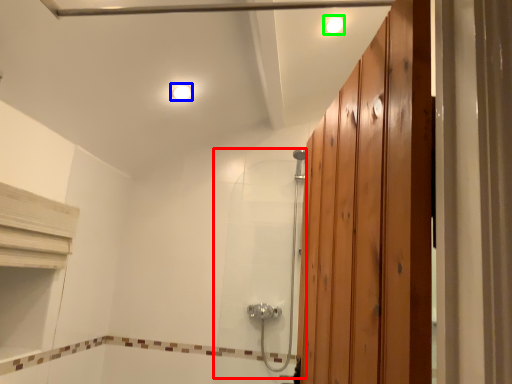
Question: Considering the real-world distances, which object is farthest from shower door (highlighted by a red box)? light fixture (highlighted by a blue box) or light fixture (highlighted by a green box)?

Choices:
 (A) light fixture
 (B) light fixture

Answer: (B)